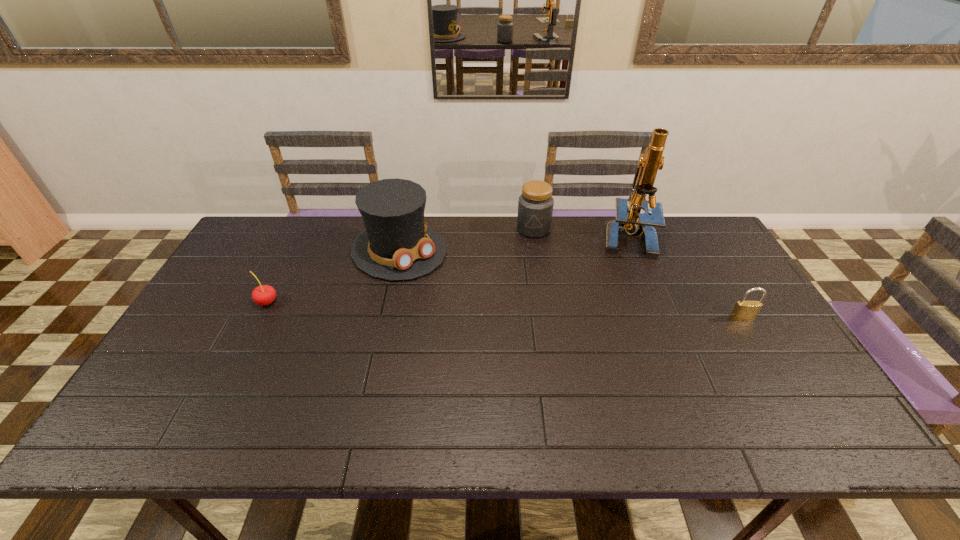
In the image, there is a desktop. At what (x,y) coordinates should I click in order to perform the action: click on vacant area at the far right corner. Please return your answer as a coordinate pair (x, y). Image resolution: width=960 pixels, height=540 pixels. Looking at the image, I should click on (691, 227).

The image size is (960, 540). I want to click on vacant space that's between the cherry and the nearest object, so coord(505,309).

Image resolution: width=960 pixels, height=540 pixels. What are the coordinates of `free space between the padlock and the dress hat` in the screenshot? It's located at (570, 284).

This screenshot has width=960, height=540. In order to click on unoccupied area between the fourth object from left to right and the leftmost object in this screenshot , I will do `click(447, 269)`.

Where is `free space between the fourth farthest object and the fourth shortest object`? The image size is (960, 540). free space between the fourth farthest object and the fourth shortest object is located at coordinates (333, 276).

Identify the location of unoccupied position between the microscope and the cherry. pos(447,269).

Locate an element on the screen. free space between the third object from right to left and the fourth object from right to left is located at coordinates (467, 239).

The width and height of the screenshot is (960, 540). What are the coordinates of `vacant area that lies between the jar and the fourth object from right to left` in the screenshot? It's located at [467, 239].

The image size is (960, 540). Identify the location of vacant space that is in between the jar and the nearest object. (637, 273).

Identify the location of vacant area between the jar and the rightmost object. (637, 273).